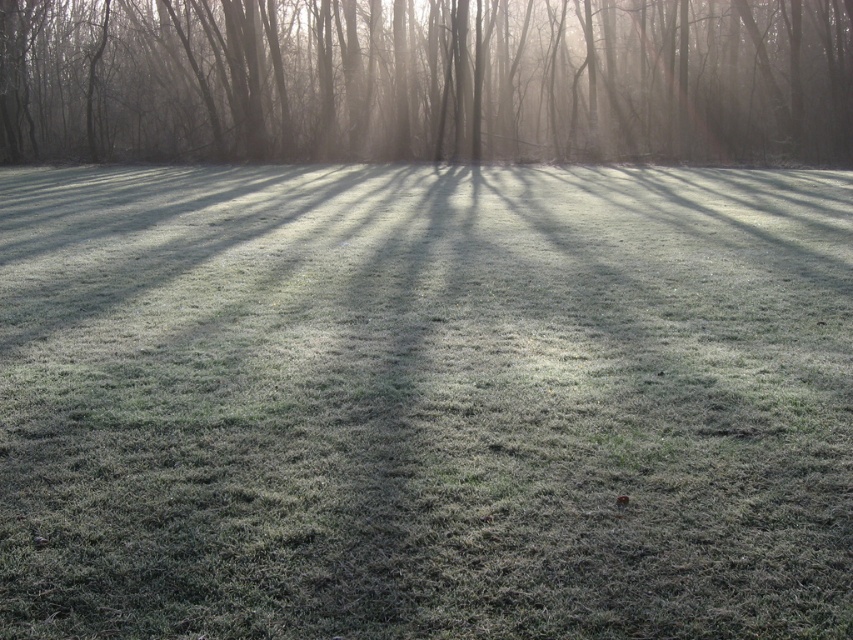
You are standing in the frosty field depicted in the scene. There is a specific point marked at coordinates point (424, 403). What is located at this point?

The point (424, 403) corresponds to frosted grass at center.

You are a photographer trying to capture the frosted grass at center and the smooth bark tree at upper center in a single shot. Based on their sizes in the image, which object would appear closer to the camera?

The frosted grass at center appears closer to the camera because it is smaller than the smooth bark tree at upper center, indicating it is farther away in the scene.

You are standing in the frosty field and want to find the frosted grass at center. According to the coordinates given, where should you look relative to the trees in the background?

The frosted grass at center is located at coordinates point (424, 403), which is closer to the trees in the background than the front of the field.